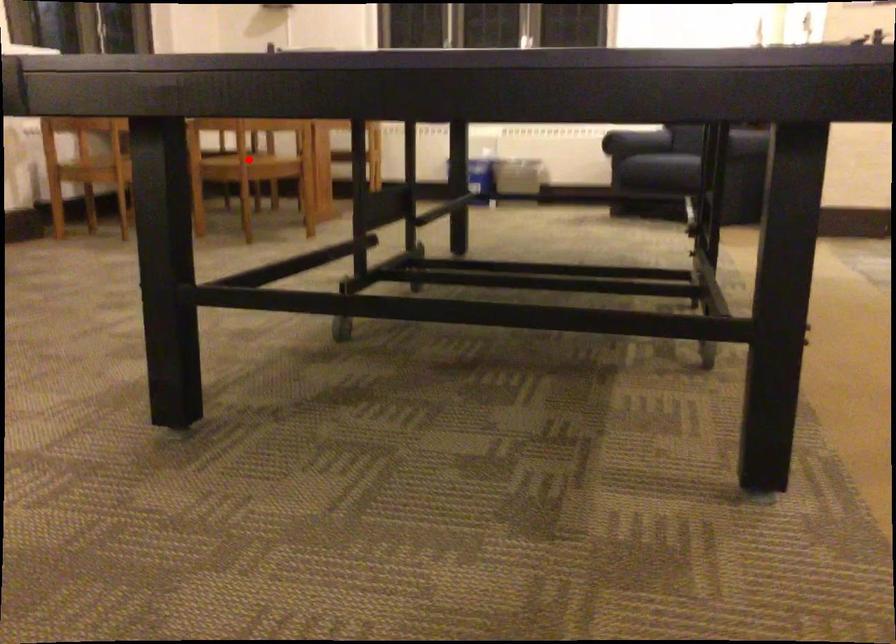
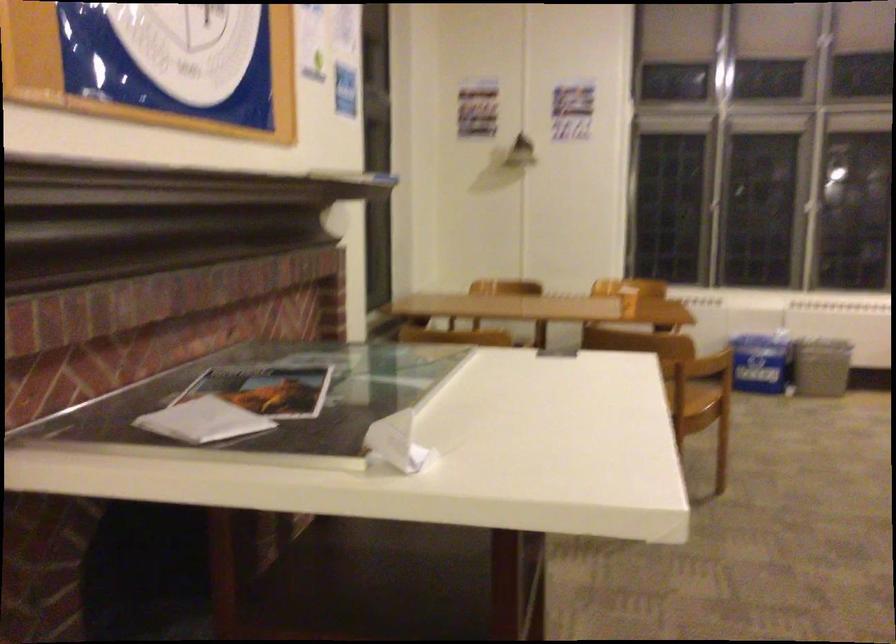
Question: I am providing you with two images of the same scene from different viewpoints. A red point is marked on the first image. Can you still see the location of the red point in image 2?

Choices:
 (A) Yes
 (B) No

Answer: (B)